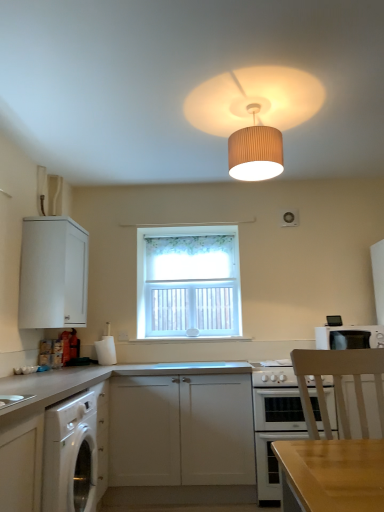
You are a GUI agent. You are given a task and a screenshot of the screen. Output one action in this format:
    pyautogui.click(x=<x>, y=<y>)
    Task: Click on the vacant area on top of floral fabric curtain at center (from a real-world perspective)
    The height and width of the screenshot is (512, 384).
    Given the screenshot: What is the action you would take?
    coord(188,233)